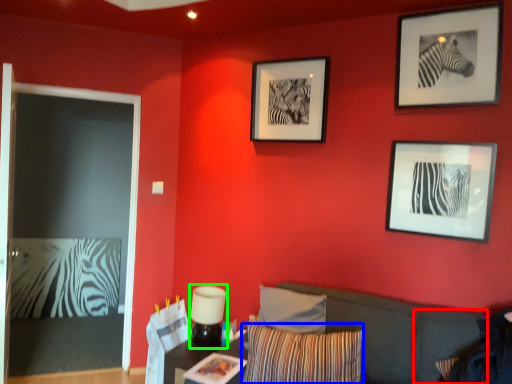
Question: Which object is positioned closest to pillow (highlighted by a red box)? Select from pillow (highlighted by a blue box) and lamp (highlighted by a green box).

Choices:
 (A) pillow
 (B) lamp

Answer: (A)